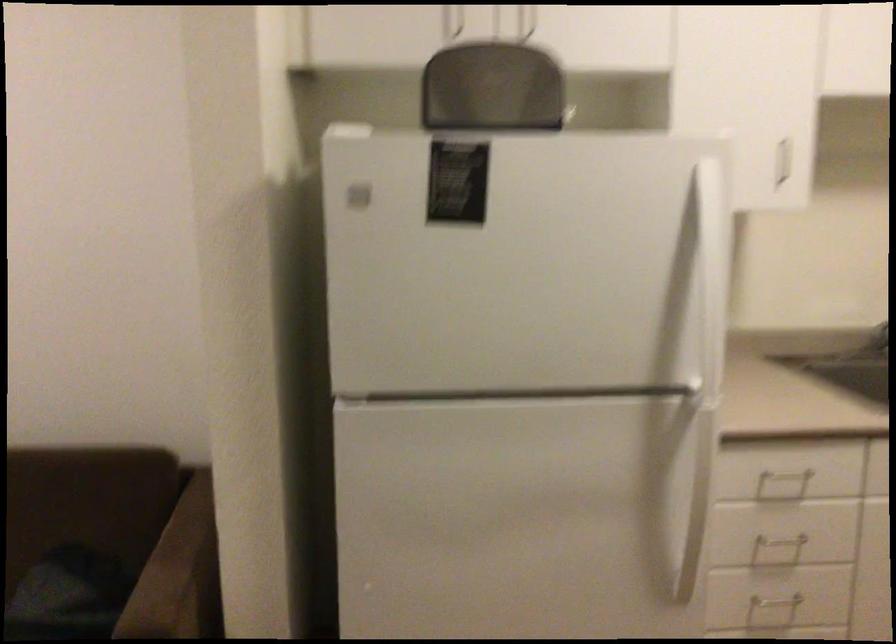
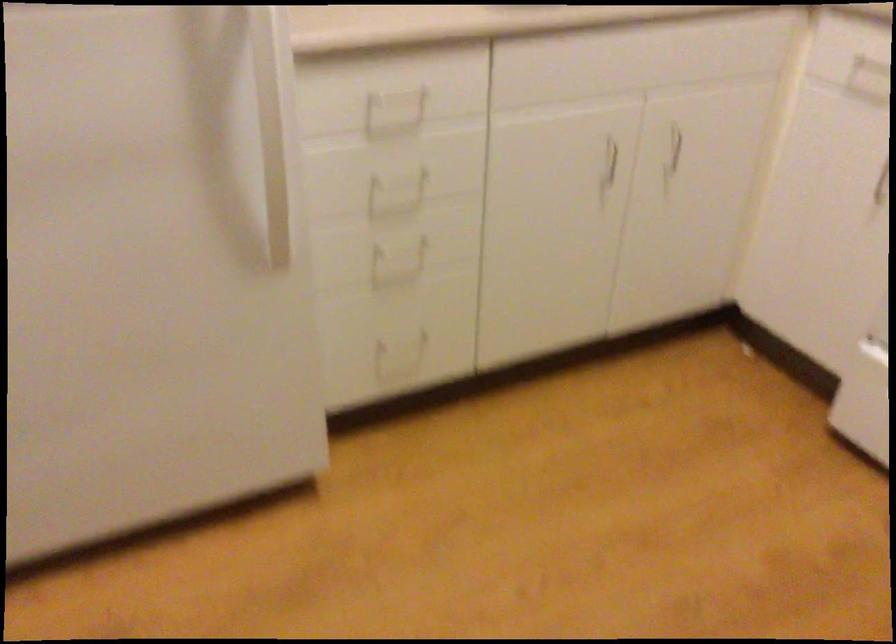
In the second image, find the point that corresponds to [796,471] in the first image.

(403, 91)